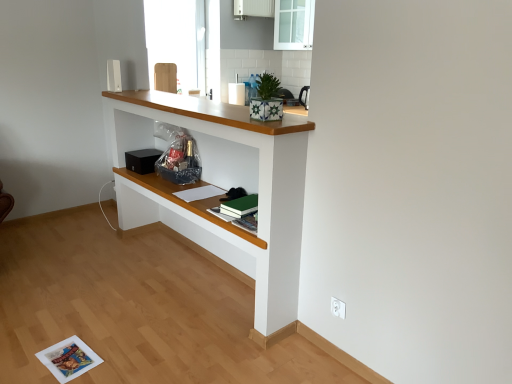
Question: Is white painted wood shelf at center inside the boundaries of transparent glass cabinet at upper center, or outside?

Choices:
 (A) inside
 (B) outside

Answer: (B)

Question: Looking at their shapes, would you say white painted wood shelf at center is wider or thinner than transparent glass cabinet at upper center?

Choices:
 (A) thin
 (B) wide

Answer: (B)

Question: Estimate the real-world distances between objects in this image. Which object is farther from the white plastic electric outlet at lower right?

Choices:
 (A) white glossy cabinet at upper center
 (B) transparent glass cabinet at upper center
 (C) black matte speaker at center
 (D) white painted wood shelf at center

Answer: (A)

Question: Considering the real-world distances, which object is closest to the white glossy cabinet at upper center?

Choices:
 (A) transparent glass cabinet at upper center
 (B) white plastic electric outlet at lower right
 (C) black matte speaker at center
 (D) white painted wood shelf at center

Answer: (A)